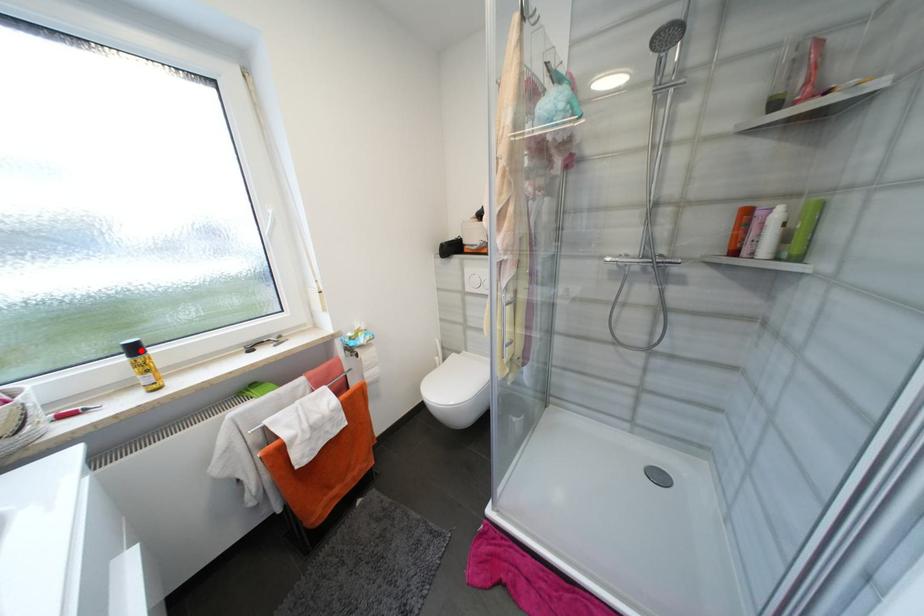
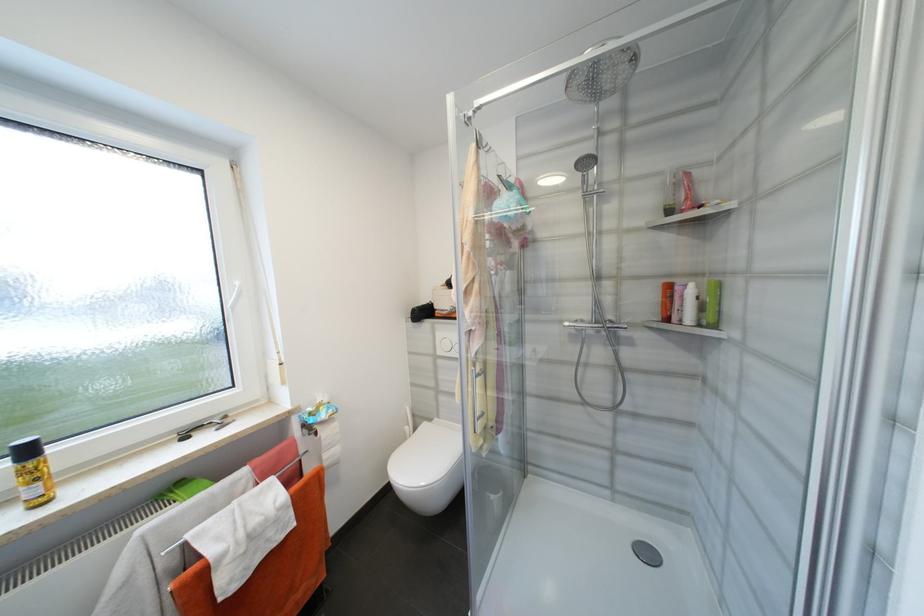
Where in the second image is the point corresponding to the highlighted location from the first image?

(33, 453)